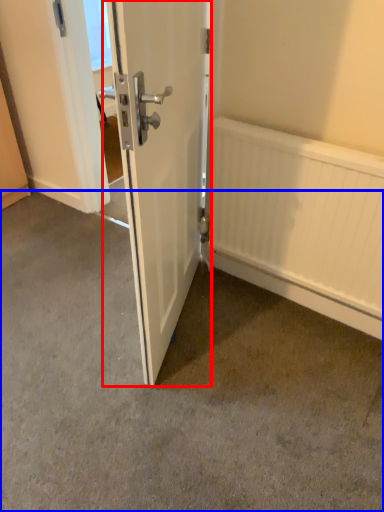
Question: Which object appears closest to the camera in this image, door (highlighted by a red box) or concrete (highlighted by a blue box)?

Choices:
 (A) door
 (B) concrete

Answer: (A)